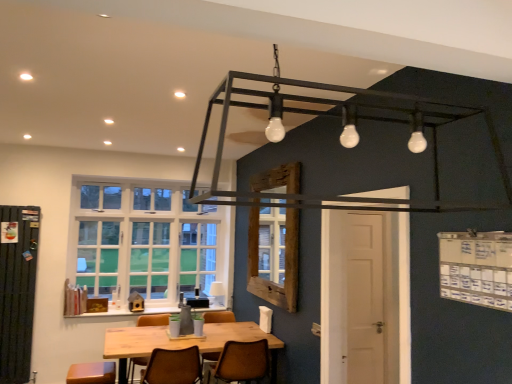
Question: Is wooden table at center positioned in front of white glass window at left, the first window when ordered from left to right?

Choices:
 (A) no
 (B) yes

Answer: (B)

Question: Does wooden table at center appear on the right side of white glass window at left, arranged as the second window when viewed from the right?

Choices:
 (A) yes
 (B) no

Answer: (A)

Question: Can you confirm if wooden table at center is shorter than white glass window at left, the first window when ordered from left to right?

Choices:
 (A) yes
 (B) no

Answer: (A)

Question: From a real-world perspective, is wooden table at center on top of white glass window at left, arranged as the second window when viewed from the right?

Choices:
 (A) yes
 (B) no

Answer: (B)

Question: Is wooden table at center smaller than white glass window at left, the 2th window viewed from the front?

Choices:
 (A) yes
 (B) no

Answer: (B)

Question: From the image's perspective, is wooden table at center on top of white glass window at left, the 2th window viewed from the front?

Choices:
 (A) no
 (B) yes

Answer: (A)

Question: Does wooden frame at center, the first window from the right, have a greater height compared to brown leather chair at center, which appears as the 1th chair when viewed from the left?

Choices:
 (A) yes
 (B) no

Answer: (A)

Question: Is wooden frame at center, the second window viewed from the left, positioned with its back to brown leather chair at center, which appears as the 1th chair when viewed from the left?

Choices:
 (A) yes
 (B) no

Answer: (B)

Question: Is brown leather chair at center, the 2th chair viewed from the right, surrounded by wooden frame at center, which is the first window from front to back?

Choices:
 (A) no
 (B) yes

Answer: (A)

Question: Can we say wooden frame at center, the second window in the back-to-front sequence, lies outside brown leather chair at center, the 2th chair viewed from the right?

Choices:
 (A) yes
 (B) no

Answer: (A)

Question: Is wooden frame at center, which is the first window from front to back, positioned before brown leather chair at center, which appears as the 1th chair when viewed from the left?

Choices:
 (A) no
 (B) yes

Answer: (A)

Question: Is wooden frame at center, the first window from the right, further to camera compared to brown leather chair at center, which appears as the 1th chair when viewed from the left?

Choices:
 (A) no
 (B) yes

Answer: (B)

Question: Would you say wooden table at center is outside metallic black frame at upper center?

Choices:
 (A) no
 (B) yes

Answer: (B)